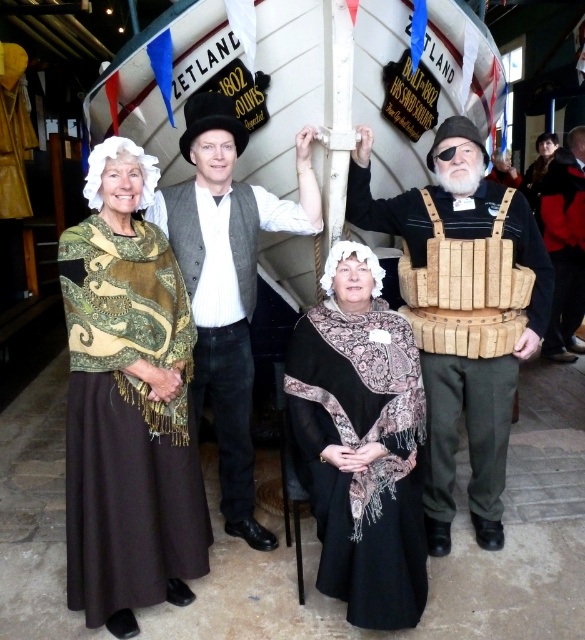
Question: Is brown woolen skirt at center below red leather jacket at lower right?

Choices:
 (A) no
 (B) yes

Answer: (B)

Question: Estimate the real-world distances between objects in this image. Which object is farther from the wooden crates at center?

Choices:
 (A) black silk shawl at center
 (B) brown woolen skirt at center
 (C) green patterned shawl at center

Answer: (B)

Question: Can you confirm if black silk shawl at center is positioned below smooth gray vest at center?

Choices:
 (A) yes
 (B) no

Answer: (A)

Question: Among these objects, which one is nearest to the camera?

Choices:
 (A) red leather jacket at lower right
 (B) black silk shawl at center
 (C) brown woolen skirt at center
 (D) smooth gray vest at center

Answer: (B)

Question: Which object appears farthest from the camera in this image?

Choices:
 (A) green patterned shawl at center
 (B) red leather jacket at lower right
 (C) smooth gray vest at center
 (D) black silk shawl at center

Answer: (B)

Question: Can you confirm if green patterned shawl at center is bigger than wooden crates at center?

Choices:
 (A) no
 (B) yes

Answer: (B)